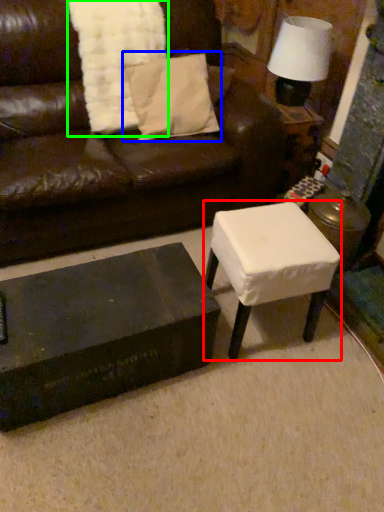
Question: Based on their relative distances, which object is nearer to table (highlighted by a red box)? Choose from pillow (highlighted by a blue box) and blanket (highlighted by a green box).

Choices:
 (A) pillow
 (B) blanket

Answer: (A)